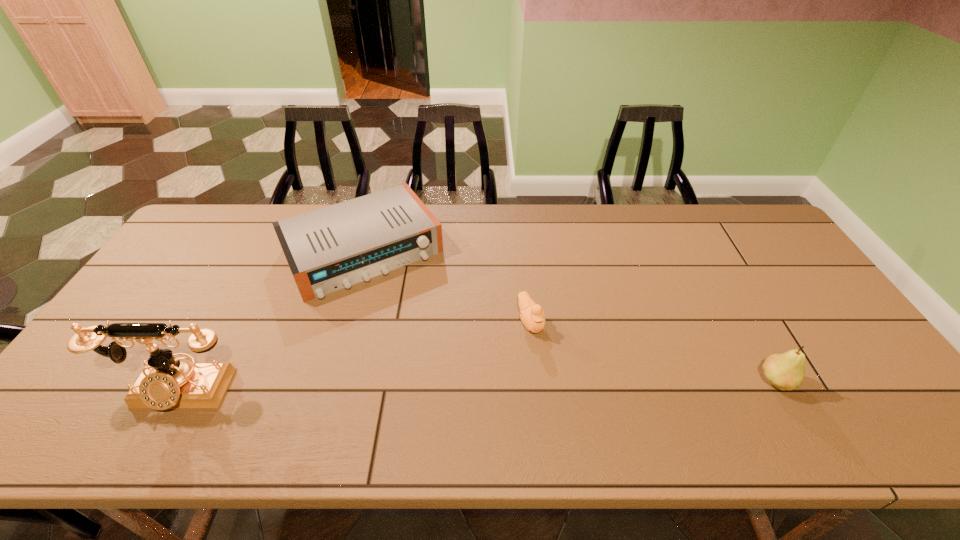
The width and height of the screenshot is (960, 540). Identify the location of the tallest object. (165, 382).

Find the location of a particular element. the rightmost object is located at coordinates (785, 371).

At what (x,y) coordinates should I click in order to perform the action: click on pear. Please return your answer as a coordinate pair (x, y). Image resolution: width=960 pixels, height=540 pixels. Looking at the image, I should click on (785, 371).

Find the location of `radio receiver`. radio receiver is located at coordinates (334, 247).

Identify the location of the third nearest object. (533, 316).

Locate an element on the screen. The width and height of the screenshot is (960, 540). the third object from left to right is located at coordinates coord(533,316).

The width and height of the screenshot is (960, 540). What are the coordinates of `vacant space located 0.120m on the left of the second tallest object` in the screenshot? It's located at (708, 382).

Where is `blank space located on the control panel of the radio receiver`? blank space located on the control panel of the radio receiver is located at coordinates (420, 335).

This screenshot has width=960, height=540. What are the coordinates of `vacant space located 0.290m on the control panel of the radio receiver` in the screenshot? It's located at (440, 368).

In order to click on vacant space located 0.320m on the control panel of the radio receiver in this screenshot , I will do `click(445, 377)`.